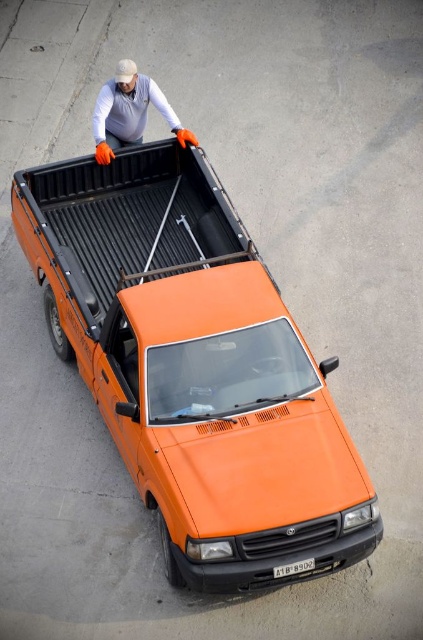
Can you confirm if orange matte truck at center is thinner than matte white shirt at upper center?

No.

Can you confirm if orange matte truck at center is shorter than matte white shirt at upper center?

Incorrect, orange matte truck at center's height does not fall short of matte white shirt at upper center's.

Identify the location of orange matte truck at center. The image size is (423, 640). (195, 365).

Does orange matte truck at center have a larger size compared to black plastic license plate at bottom center?

Yes, orange matte truck at center is bigger than black plastic license plate at bottom center.

Is orange matte truck at center above black plastic license plate at bottom center?

Correct, orange matte truck at center is located above black plastic license plate at bottom center.

The height and width of the screenshot is (640, 423). Identify the location of orange matte truck at center. (195, 365).

Does matte white shirt at upper center have a lesser height compared to black plastic license plate at bottom center?

No.

Identify the location of matte white shirt at upper center. Image resolution: width=423 pixels, height=640 pixels. (129, 112).